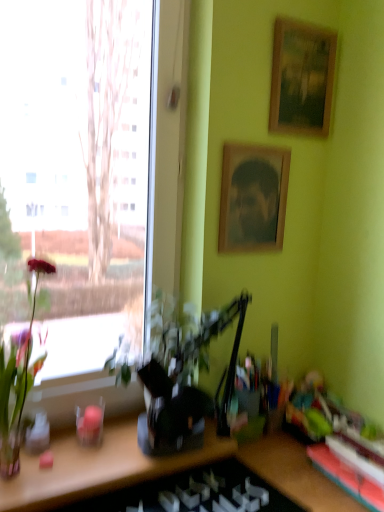
You are a GUI agent. You are given a task and a screenshot of the screen. Output one action in this format:
    pyautogui.click(x=<x>, y=<y>)
    Task: Click on the wooden picture frame at upper center, positioned as the second picture frame in top-to-bottom order
    
    Given the screenshot: What is the action you would take?
    pyautogui.click(x=253, y=198)

Describe the element at coordinates (18, 382) in the screenshot. I see `green glossy plant at left, the second houseplant positioned from the right` at that location.

This screenshot has width=384, height=512. What do you see at coordinates (346, 477) in the screenshot? I see `wooden bookshelf at lower right` at bounding box center [346, 477].

Locate an element on the screen. rubberized green toy at lower right is located at coordinates (309, 407).

From a real-world perspective, which object stands above the other?

In real-world perspective, transparent glass window at left is above.

Does point (116, 275) appear closer or farther from the camera than point (212, 324)?

Point (116, 275) is positioned farther from the camera compared to point (212, 324).

Considering the relative sizes of transparent glass window at left and green leafy plant at left, positioned as the 2th houseplant in left-to-right order, in the image provided, is transparent glass window at left shorter than green leafy plant at left, positioned as the 2th houseplant in left-to-right order,?

In fact, transparent glass window at left may be taller than green leafy plant at left, positioned as the 2th houseplant in left-to-right order.

From the image's perspective, which one is positioned higher, transparent glass window at left or green leafy plant at left, which is the 1th houseplant in right-to-left order?

transparent glass window at left.

Between wooden framed picture at upper right, the second picture frame ordered from the bottom, and green leafy plant at left, which is the 1th houseplant in right-to-left order, which one has more height?

green leafy plant at left, which is the 1th houseplant in right-to-left order, is taller.

Is wooden framed picture at upper right, the second picture frame ordered from the bottom, positioned far away from green leafy plant at left, positioned as the 2th houseplant in left-to-right order?

No, there isn't a large distance between wooden framed picture at upper right, the second picture frame ordered from the bottom, and green leafy plant at left, positioned as the 2th houseplant in left-to-right order.

From the image's perspective, which is above, wooden framed picture at upper right, which ranks as the 1th picture frame in top-to-bottom order, or green leafy plant at left, positioned as the 2th houseplant in left-to-right order?

wooden framed picture at upper right, which ranks as the 1th picture frame in top-to-bottom order, is shown above in the image.

Looking at their sizes, would you say wooden framed picture at upper right, the second picture frame ordered from the bottom, is wider or thinner than green leafy plant at left, which is the 1th houseplant in right-to-left order?

In the image, wooden framed picture at upper right, the second picture frame ordered from the bottom, appears to be more narrow than green leafy plant at left, which is the 1th houseplant in right-to-left order.

Is rubberized green toy at lower right outside of wooden bookshelf at lower right?

rubberized green toy at lower right lies outside wooden bookshelf at lower right's area.

Can you see rubberized green toy at lower right touching wooden bookshelf at lower right?

rubberized green toy at lower right and wooden bookshelf at lower right are not in contact.

Is rubberized green toy at lower right oriented towards wooden bookshelf at lower right?

No, rubberized green toy at lower right is not aimed at wooden bookshelf at lower right.

Who is shorter, transparent glass window at left or green glossy plant at left, arranged as the first houseplant when viewed from the left?

With less height is green glossy plant at left, arranged as the first houseplant when viewed from the left.

Based on the photo, can you tell me how much transparent glass window at left and green glossy plant at left, arranged as the first houseplant when viewed from the left, differ in facing direction?

The facing directions of transparent glass window at left and green glossy plant at left, arranged as the first houseplant when viewed from the left, are 0.744 degrees apart.

Which object is positioned more to the right, transparent glass window at left or green glossy plant at left, arranged as the first houseplant when viewed from the left?

transparent glass window at left is more to the right.

Consider the image. Which of these two, transparent glass window at left or green glossy plant at left, the second houseplant positioned from the right, is smaller?

green glossy plant at left, the second houseplant positioned from the right.

Is wooden framed picture at upper right, which ranks as the 1th picture frame in top-to-bottom order, at the back of wooden picture frame at upper center, positioned as the second picture frame in top-to-bottom order?

That's not correct — wooden picture frame at upper center, positioned as the second picture frame in top-to-bottom order, is not looking away from wooden framed picture at upper right, which ranks as the 1th picture frame in top-to-bottom order.

From the picture: Is wooden picture frame at upper center, which ranks as the 1th picture frame in bottom-to-top order, inside or outside of wooden framed picture at upper right, the second picture frame ordered from the bottom?

wooden picture frame at upper center, which ranks as the 1th picture frame in bottom-to-top order, exists outside the volume of wooden framed picture at upper right, the second picture frame ordered from the bottom.

At what (x,y) coordinates should I click in order to perform the action: click on picture frame on the left of wooden framed picture at upper right, the second picture frame ordered from the bottom. Please return your answer as a coordinate pair (x, y). This screenshot has width=384, height=512. Looking at the image, I should click on (253, 198).

How different are the orientations of wooden picture frame at upper center, positioned as the second picture frame in top-to-bottom order, and wooden framed picture at upper right, which ranks as the 1th picture frame in top-to-bottom order, in degrees?

There is a 1.29-degree angle between the facing directions of wooden picture frame at upper center, positioned as the second picture frame in top-to-bottom order, and wooden framed picture at upper right, which ranks as the 1th picture frame in top-to-bottom order.

From the image's perspective, relative to transparent glass window at left, is wooden framed picture at upper right, the second picture frame ordered from the bottom, above or below?

Clearly, from the image's perspective, wooden framed picture at upper right, the second picture frame ordered from the bottom, is above transparent glass window at left.

Can you confirm if wooden framed picture at upper right, the second picture frame ordered from the bottom, is positioned to the left of transparent glass window at left?

No.

Between wooden framed picture at upper right, the second picture frame ordered from the bottom, and transparent glass window at left, which one has larger size?

With larger size is transparent glass window at left.

Does point (275, 27) lie in front of point (55, 346)?

Yes, it is.

Does wooden bookshelf at lower right have a greater width compared to green glossy plant at left, the second houseplant positioned from the right?

Indeed, wooden bookshelf at lower right has a greater width compared to green glossy plant at left, the second houseplant positioned from the right.

From a real-world perspective, which is physically above, wooden bookshelf at lower right or green glossy plant at left, the second houseplant positioned from the right?

green glossy plant at left, the second houseplant positioned from the right, from a real-world perspective.

Is wooden bookshelf at lower right not close to green glossy plant at left, the second houseplant positioned from the right?

No, wooden bookshelf at lower right is not far away from green glossy plant at left, the second houseplant positioned from the right.

Is wooden bookshelf at lower right looking in the opposite direction of green glossy plant at left, arranged as the first houseplant when viewed from the left?

wooden bookshelf at lower right is not turned away from green glossy plant at left, arranged as the first houseplant when viewed from the left.

This screenshot has width=384, height=512. Identify the location of window to the left of green leafy plant at left, positioned as the 2th houseplant in left-to-right order. (77, 191).

The height and width of the screenshot is (512, 384). In order to click on houseplant that is the 2nd one when counting downward from the wooden framed picture at upper right, the second picture frame ordered from the bottom (from the image's perspective) in this screenshot , I will do `click(185, 379)`.

When comparing their distances from wooden framed picture at upper right, which ranks as the 1th picture frame in top-to-bottom order, does wooden picture frame at upper center, positioned as the second picture frame in top-to-bottom order, or wooden bookshelf at lower right seem further?

wooden bookshelf at lower right.

Looking at the image, which one is located further to green glossy plant at left, arranged as the first houseplant when viewed from the left, rubberized green toy at lower right or green leafy plant at left, positioned as the 2th houseplant in left-to-right order?

rubberized green toy at lower right.

Consider the image. Looking at the image, which one is located further to wooden picture frame at upper center, which ranks as the 1th picture frame in bottom-to-top order, green glossy plant at left, the second houseplant positioned from the right, or rubberized green toy at lower right?

The object further to wooden picture frame at upper center, which ranks as the 1th picture frame in bottom-to-top order, is green glossy plant at left, the second houseplant positioned from the right.

Which object lies further to the anchor point green glossy plant at left, arranged as the first houseplant when viewed from the left, wooden bookshelf at lower right or transparent glass window at left?

transparent glass window at left.

From the image, which object appears to be farther from transparent glass window at left, wooden picture frame at upper center, which ranks as the 1th picture frame in bottom-to-top order, or wooden bookshelf at lower right?

wooden bookshelf at lower right is positioned further to the anchor transparent glass window at left.

Based on their spatial positions, is wooden framed picture at upper right, which ranks as the 1th picture frame in top-to-bottom order, or transparent glass window at left closer to green leafy plant at left, which is the 1th houseplant in right-to-left order?

Among the two, wooden framed picture at upper right, which ranks as the 1th picture frame in top-to-bottom order, is located nearer to green leafy plant at left, which is the 1th houseplant in right-to-left order.

From the image, which object appears to be farther from green leafy plant at left, positioned as the 2th houseplant in left-to-right order, wooden framed picture at upper right, which ranks as the 1th picture frame in top-to-bottom order, or green glossy plant at left, the second houseplant positioned from the right?

Among the two, wooden framed picture at upper right, which ranks as the 1th picture frame in top-to-bottom order, is located further to green leafy plant at left, positioned as the 2th houseplant in left-to-right order.

Looking at the image, which one is located further to wooden bookshelf at lower right, transparent glass window at left or green glossy plant at left, the second houseplant positioned from the right?

transparent glass window at left is further to wooden bookshelf at lower right.

The image size is (384, 512). Identify the location of houseplant between transparent glass window at left and rubberized green toy at lower right. (185, 379).

Identify the location of houseplant between wooden framed picture at upper right, the second picture frame ordered from the bottom, and green leafy plant at left, which is the 1th houseplant in right-to-left order, from top to bottom. (18, 382).

Where is `toy situated between transparent glass window at left and wooden bookshelf at lower right from left to right`? The image size is (384, 512). toy situated between transparent glass window at left and wooden bookshelf at lower right from left to right is located at coordinates (309, 407).

Image resolution: width=384 pixels, height=512 pixels. What are the coordinates of `window between green glossy plant at left, arranged as the first houseplant when viewed from the left, and wooden picture frame at upper center, positioned as the second picture frame in top-to-bottom order, from left to right` in the screenshot? It's located at (77, 191).